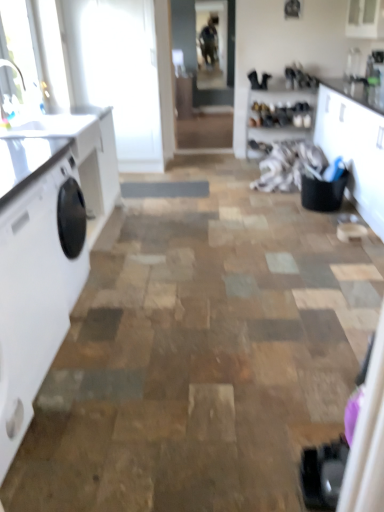
Question: Is the depth of white glossy countertop at left less than that of white glossy countertop at left?

Choices:
 (A) no
 (B) yes

Answer: (B)

Question: Is white glossy countertop at left shorter than white glossy countertop at left?

Choices:
 (A) no
 (B) yes

Answer: (B)

Question: From a real-world perspective, is white glossy countertop at left on top of white glossy countertop at left?

Choices:
 (A) yes
 (B) no

Answer: (A)

Question: Could you tell me if white glossy countertop at left is facing white glossy countertop at left?

Choices:
 (A) no
 (B) yes

Answer: (A)

Question: Is white glossy countertop at left beside white glossy countertop at left?

Choices:
 (A) yes
 (B) no

Answer: (B)

Question: From the image's perspective, is white glossy washing machine at left positioned above or below white fabric at center?

Choices:
 (A) above
 (B) below

Answer: (B)

Question: From a real-world perspective, is white glossy washing machine at left positioned above or below white fabric at center?

Choices:
 (A) above
 (B) below

Answer: (A)

Question: In the image, is white glossy washing machine at left positioned in front of or behind white fabric at center?

Choices:
 (A) behind
 (B) front

Answer: (B)

Question: Is white glossy washing machine at left bigger or smaller than white fabric at center?

Choices:
 (A) big
 (B) small

Answer: (B)

Question: Would you say white glossy countertop at left is inside or outside white glossy countertop at left?

Choices:
 (A) inside
 (B) outside

Answer: (B)

Question: Considering the positions of point (102, 154) and point (3, 197), is point (102, 154) closer or farther from the camera than point (3, 197)?

Choices:
 (A) farther
 (B) closer

Answer: (A)

Question: In terms of size, does white glossy countertop at left appear bigger or smaller than white glossy countertop at left?

Choices:
 (A) small
 (B) big

Answer: (B)

Question: Relative to white glossy countertop at left, is white glossy countertop at left in front or behind?

Choices:
 (A) behind
 (B) front

Answer: (A)

Question: From their relative heights in the image, would you say white glossy countertop at left is taller or shorter than white glossy cabinet at right?

Choices:
 (A) short
 (B) tall

Answer: (A)

Question: In terms of width, does white glossy countertop at left look wider or thinner when compared to white glossy cabinet at right?

Choices:
 (A) wide
 (B) thin

Answer: (B)